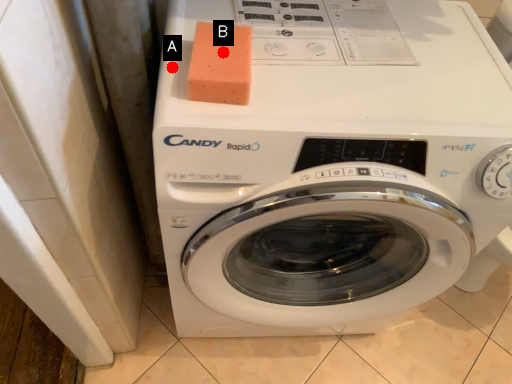
Question: Two points are circled on the image, labeled by A and B beside each circle. Which of the following is the farthest from the observer?

Choices:
 (A) A is further
 (B) B is further

Answer: (A)